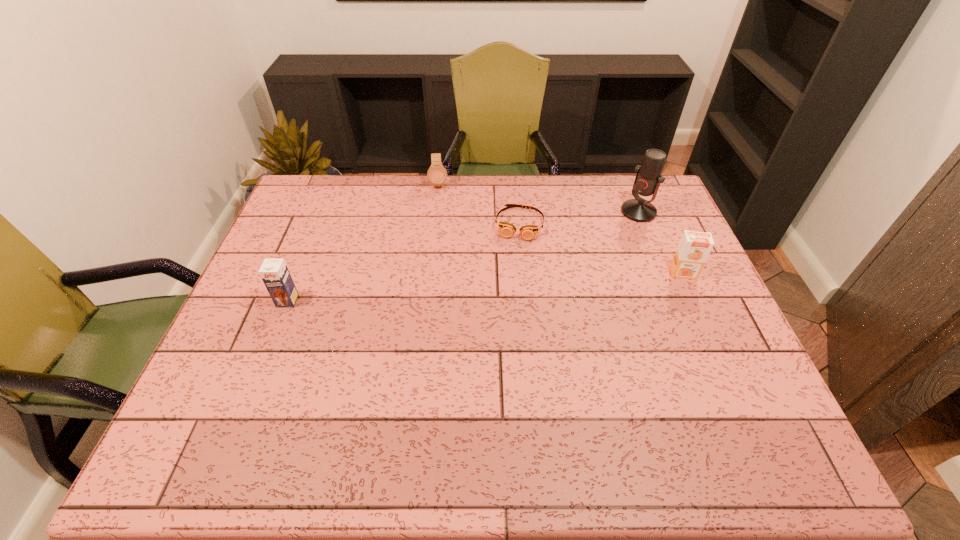
Identify the location of the nearest object. Image resolution: width=960 pixels, height=540 pixels. (274, 272).

Where is `the leftmost object`? The height and width of the screenshot is (540, 960). the leftmost object is located at coordinates pos(274,272).

Where is `orange juice`? orange juice is located at coordinates (694, 247).

I want to click on microphone, so click(x=648, y=178).

Locate an element on the screen. the shortest object is located at coordinates (528, 232).

Identify the location of goggles. (528, 232).

I want to click on the fourth object from right to left, so click(437, 175).

I want to click on the second shortest object, so click(437, 175).

This screenshot has height=540, width=960. I want to click on free space located 0.170m on the front label of the nearest object, so click(263, 362).

At what (x,y) coordinates should I click in order to perform the action: click on blank area located 0.300m on the back of the orange juice. Please return your answer as a coordinate pair (x, y). This screenshot has height=540, width=960. Looking at the image, I should click on (652, 204).